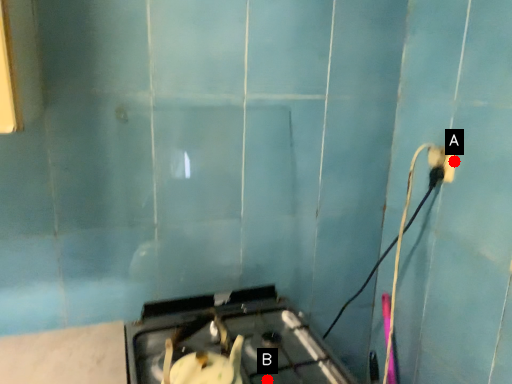
Question: Two points are circled on the image, labeled by A and B beside each circle. Which point is farther to the camera?

Choices:
 (A) A is further
 (B) B is further

Answer: (A)